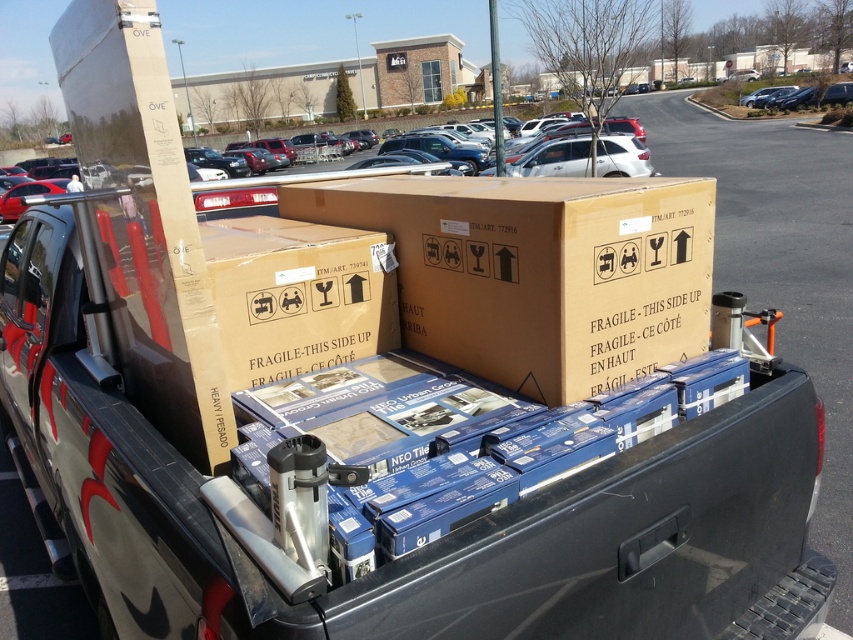
Looking at this image, you are a delivery driver who needs to load a new package that is 1.2 meters wide into the truck bed. The package must be placed between the brown cardboard box at center and the white matte suv at center. Can the package fit between them based on their widths?

The brown cardboard box at center is narrower than the white matte suv at center. However, since the package is 1.2 meters wide, we need to know the exact width difference between the two objects to determine if there is enough space. Unfortunately, the provided information only states that the brown cardboard box is narrower, but does not specify the actual width measurements. Therefore, it is impossible to confirm if the package will fit without additional details.

You are a delivery driver who needs to unload the brown cardboard box at center from the truck bed. However, there is a white matte suv at center blocking access to it. Can you remove the box without moving the suv?

The brown cardboard box at center is positioned under the white matte suv at center, so you cannot remove the box without moving the suv first because it is blocked by the suv.